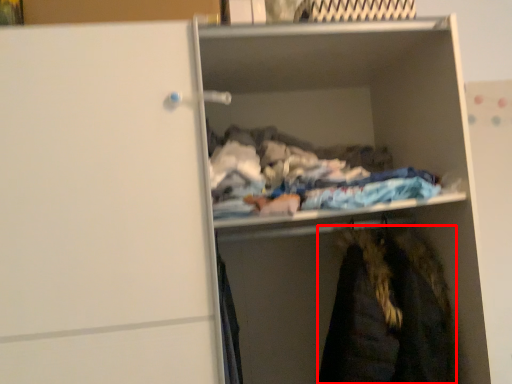
Question: From the image's perspective, considering the relative positions of cloak (annotated by the red box) and cabinet in the image provided, where is cloak (annotated by the red box) located with respect to the staircase?

Choices:
 (A) above
 (B) below

Answer: (B)